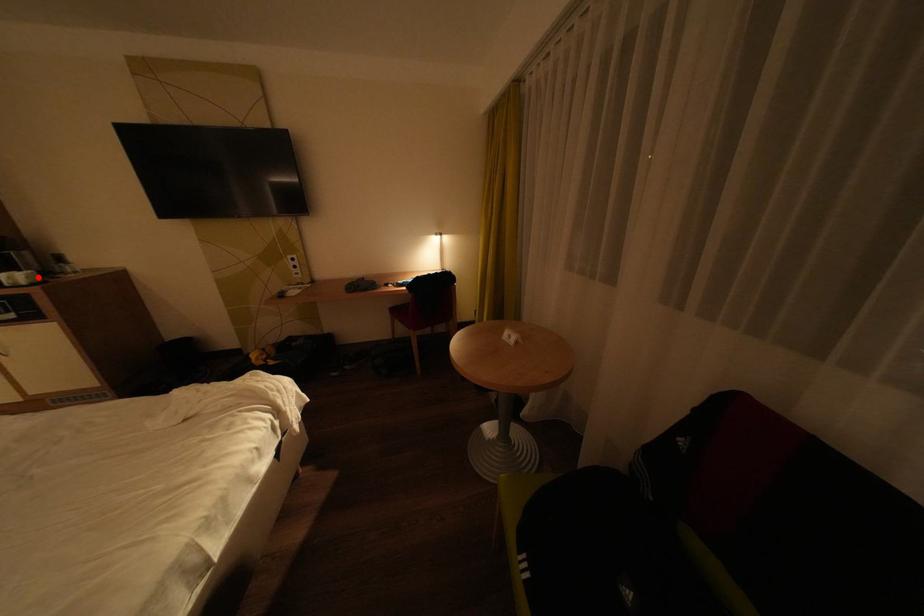
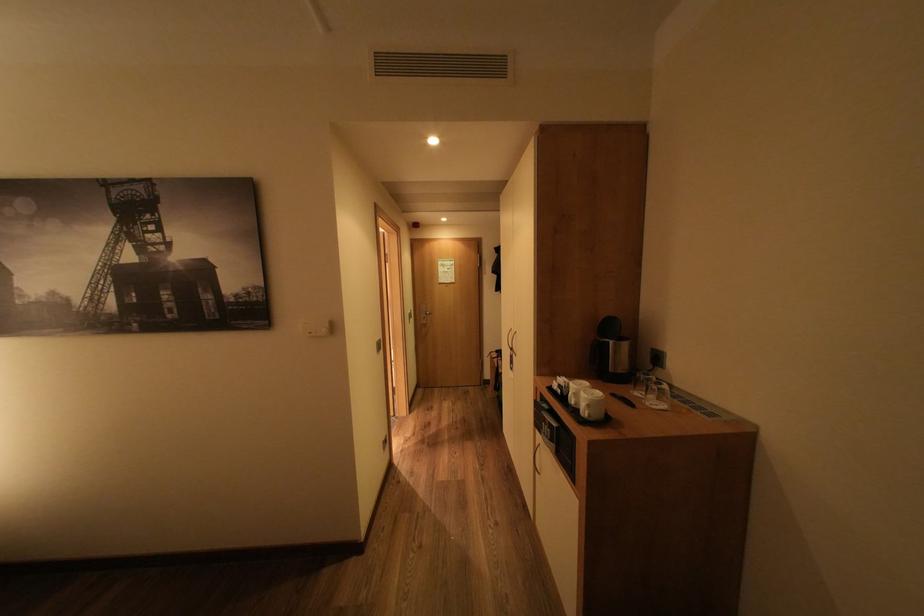
The point at the highlighted location is marked in the first image. Where is the corresponding point in the second image?

(600, 406)